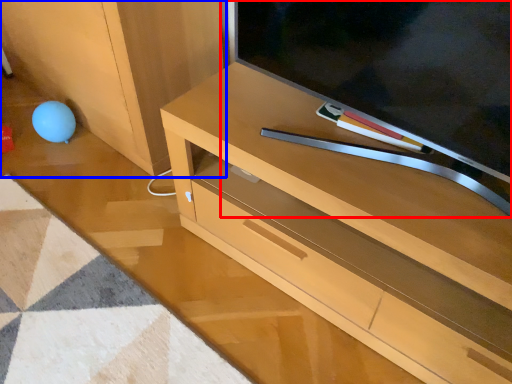
Question: Which of the following is the farthest to the observer, television (highlighted by a red box) or cabinetry (highlighted by a blue box)?

Choices:
 (A) television
 (B) cabinetry

Answer: (B)